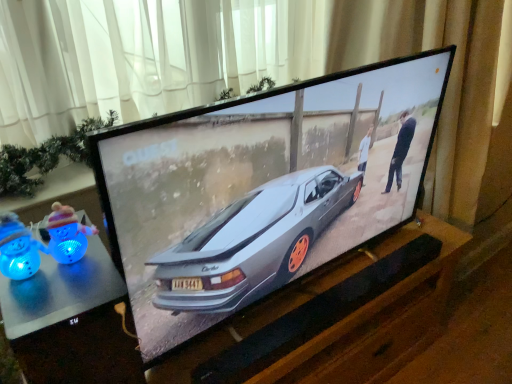
Question: Is metallic silver table at lower left aimed at white sheer curtain at upper center?

Choices:
 (A) no
 (B) yes

Answer: (A)

Question: Is metallic silver table at lower left far away from white sheer curtain at upper center?

Choices:
 (A) no
 (B) yes

Answer: (A)

Question: From the image's perspective, is metallic silver table at lower left beneath white sheer curtain at upper center?

Choices:
 (A) no
 (B) yes

Answer: (B)

Question: From a real-world perspective, is metallic silver table at lower left physically below white sheer curtain at upper center?

Choices:
 (A) no
 (B) yes

Answer: (B)

Question: Is metallic silver table at lower left to the right of white sheer curtain at upper center from the viewer's perspective?

Choices:
 (A) no
 (B) yes

Answer: (A)

Question: Is metallic silver table at lower left completely or partially outside of white sheer curtain at upper center?

Choices:
 (A) yes
 (B) no

Answer: (A)

Question: Does blue plastic toy at left, the first toy from the right, have a greater width compared to blue plastic toy at lower left, marked as the 1th toy in a left-to-right arrangement?

Choices:
 (A) no
 (B) yes

Answer: (A)

Question: Can you confirm if blue plastic toy at left, positioned as the 2th toy in left-to-right order, is thinner than blue plastic toy at lower left, which is counted as the second toy, starting from the right?

Choices:
 (A) yes
 (B) no

Answer: (A)

Question: Does blue plastic toy at left, the first toy from the right, appear on the left side of blue plastic toy at lower left, marked as the 1th toy in a left-to-right arrangement?

Choices:
 (A) no
 (B) yes

Answer: (A)

Question: Could you tell me if blue plastic toy at left, the first toy from the right, is facing blue plastic toy at lower left, which is counted as the second toy, starting from the right?

Choices:
 (A) yes
 (B) no

Answer: (B)

Question: From the image's perspective, is blue plastic toy at left, positioned as the 2th toy in left-to-right order, under blue plastic toy at lower left, which is counted as the second toy, starting from the right?

Choices:
 (A) no
 (B) yes

Answer: (A)

Question: From the image's perspective, is blue plastic toy at left, positioned as the 2th toy in left-to-right order, above blue plastic toy at lower left, marked as the 1th toy in a left-to-right arrangement?

Choices:
 (A) yes
 (B) no

Answer: (A)

Question: Considering the relative sizes of white sheer curtain at upper center and blue plastic toy at lower left, marked as the 1th toy in a left-to-right arrangement, in the image provided, is white sheer curtain at upper center taller than blue plastic toy at lower left, marked as the 1th toy in a left-to-right arrangement,?

Choices:
 (A) no
 (B) yes

Answer: (B)